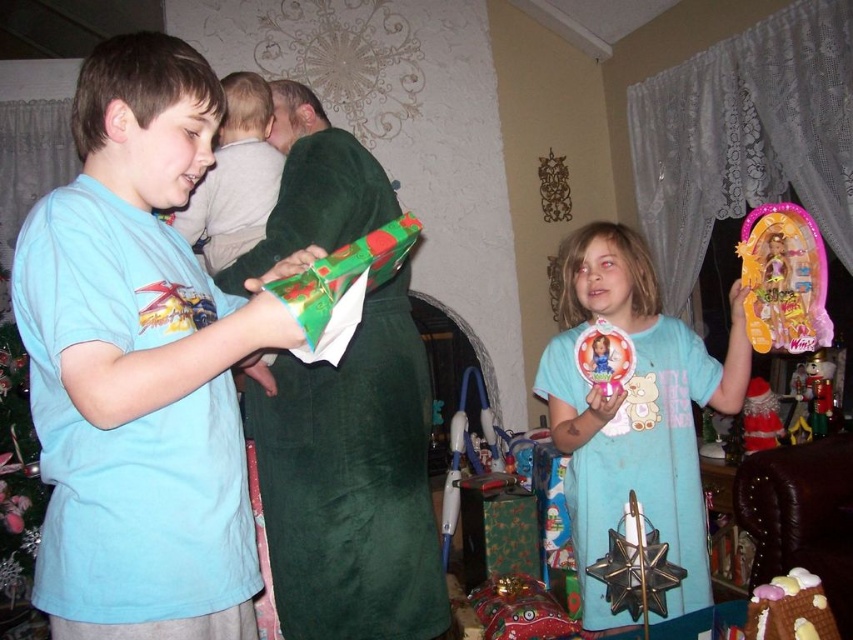
Question: Is blue matte dress at center below shiny plastic doll at upper right?

Choices:
 (A) yes
 (B) no

Answer: (A)

Question: Which point is farther to the camera?

Choices:
 (A) shiny plastic doll at upper right
 (B) chocolate cake at lower right
 (C) blue matte dress at center

Answer: (C)

Question: Considering the real-world distances, which object is farthest from the shiny plastic doll at upper right?

Choices:
 (A) satin red santa hat at upper right
 (B) chocolate cake at lower right

Answer: (A)

Question: Is blue matte dress at center wider than satin red santa hat at upper right?

Choices:
 (A) yes
 (B) no

Answer: (A)

Question: Which point is farther to the camera?

Choices:
 (A) matte blue shirt at left
 (B) chocolate cake at lower right
 (C) matte green blanket at upper center
 (D) green shiny wrapping paper at center

Answer: (B)

Question: Does matte blue shirt at left have a lesser width compared to shiny plastic doll at upper right?

Choices:
 (A) no
 (B) yes

Answer: (A)